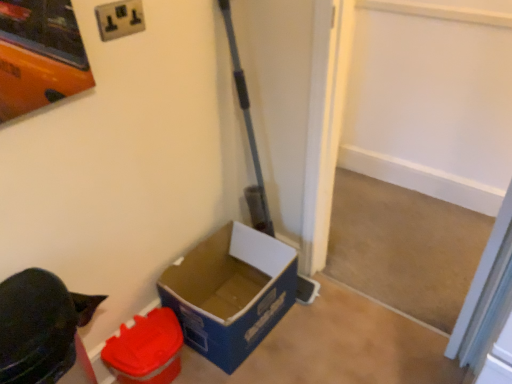
Question: Is blue cardboard box at lower left, arranged as the 1th box when viewed from the right, at the back of matte plastic container at lower left, the 1th box viewed from the left?

Choices:
 (A) no
 (B) yes

Answer: (A)

Question: Can you confirm if matte plastic container at lower left, the 1th box viewed from the left, is wider than blue cardboard box at lower left, the 2th box from the left?

Choices:
 (A) yes
 (B) no

Answer: (B)

Question: Considering the relative sizes of matte plastic container at lower left, the 1th box viewed from the left, and blue cardboard box at lower left, arranged as the 1th box when viewed from the right, in the image provided, is matte plastic container at lower left, the 1th box viewed from the left, shorter than blue cardboard box at lower left, arranged as the 1th box when viewed from the right,?

Choices:
 (A) no
 (B) yes

Answer: (B)

Question: Does matte plastic container at lower left, the 1th box viewed from the left, lie behind blue cardboard box at lower left, arranged as the 1th box when viewed from the right?

Choices:
 (A) no
 (B) yes

Answer: (A)

Question: Is the depth of matte plastic container at lower left, the 1th box viewed from the left, less than that of blue cardboard box at lower left, the 2th box from the left?

Choices:
 (A) yes
 (B) no

Answer: (A)

Question: Considering the positions of white plastic electric outlet at upper center and blue cardboard box at lower left, the 2th box from the left, in the image, is white plastic electric outlet at upper center taller or shorter than blue cardboard box at lower left, the 2th box from the left,?

Choices:
 (A) short
 (B) tall

Answer: (A)

Question: Considering the relative positions of white plastic electric outlet at upper center and blue cardboard box at lower left, the 2th box from the left, in the image provided, is white plastic electric outlet at upper center to the left or to the right of blue cardboard box at lower left, the 2th box from the left,?

Choices:
 (A) left
 (B) right

Answer: (A)

Question: Is white plastic electric outlet at upper center in front of or behind blue cardboard box at lower left, arranged as the 1th box when viewed from the right, in the image?

Choices:
 (A) front
 (B) behind

Answer: (A)

Question: In terms of width, does white plastic electric outlet at upper center look wider or thinner when compared to blue cardboard box at lower left, the 2th box from the left?

Choices:
 (A) wide
 (B) thin

Answer: (B)

Question: In terms of width, does matte plastic container at lower left, the 1th box viewed from the left, look wider or thinner when compared to white plastic electric outlet at upper center?

Choices:
 (A) wide
 (B) thin

Answer: (A)

Question: Is matte plastic container at lower left, the 1th box viewed from the left, in front of or behind white plastic electric outlet at upper center in the image?

Choices:
 (A) behind
 (B) front

Answer: (A)

Question: Is matte plastic container at lower left, the second box in the right-to-left sequence, taller or shorter than white plastic electric outlet at upper center?

Choices:
 (A) short
 (B) tall

Answer: (B)

Question: Does point (167, 332) appear closer or farther from the camera than point (139, 29)?

Choices:
 (A) closer
 (B) farther

Answer: (B)

Question: Does point (142, 354) appear closer or farther from the camera than point (182, 331)?

Choices:
 (A) farther
 (B) closer

Answer: (B)

Question: Is matte plastic container at lower left, the 1th box viewed from the left, inside the boundaries of blue cardboard box at lower left, the 2th box from the left, or outside?

Choices:
 (A) inside
 (B) outside

Answer: (B)